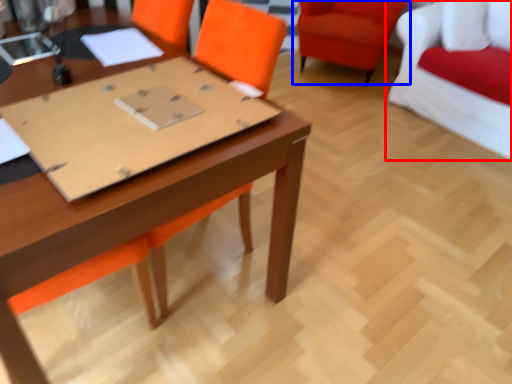
Question: Among these objects, which one is nearest to the camera, chair (highlighted by a red box) or chair (highlighted by a blue box)?

Choices:
 (A) chair
 (B) chair

Answer: (A)